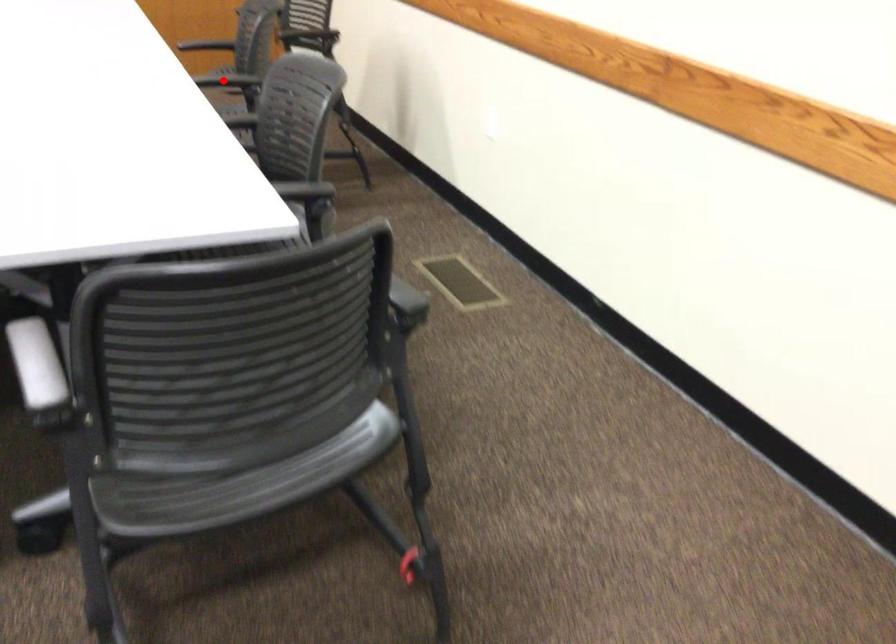
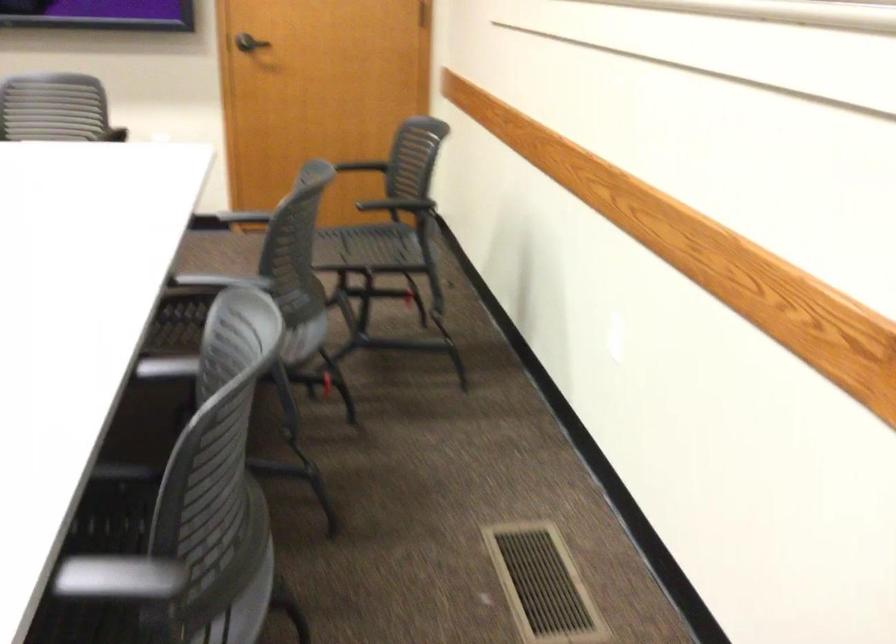
Question: I am providing you with two images of the same scene from different viewpoints. In image1, a red point is highlighted. Considering the same 3D point in image2, which of the following is correct?

Choices:
 (A) It is closer
 (B) It is farther

Answer: (A)